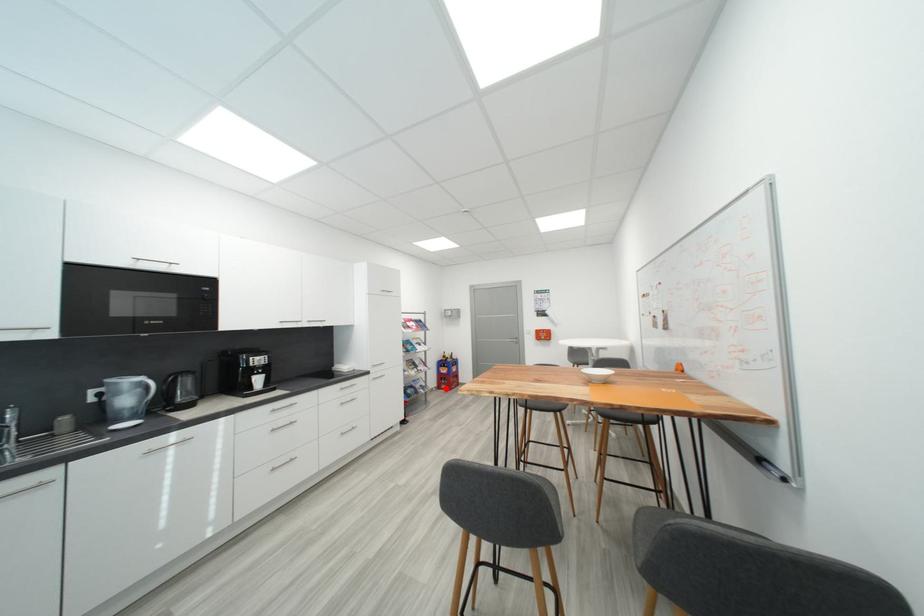
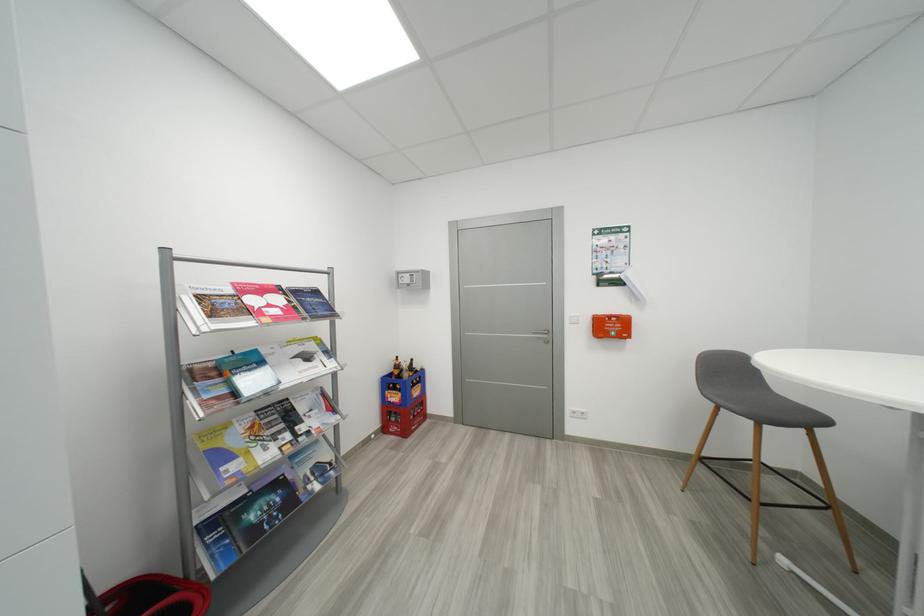
The point at the highlighted location is marked in the first image. Where is the corresponding point in the second image?

(392, 431)